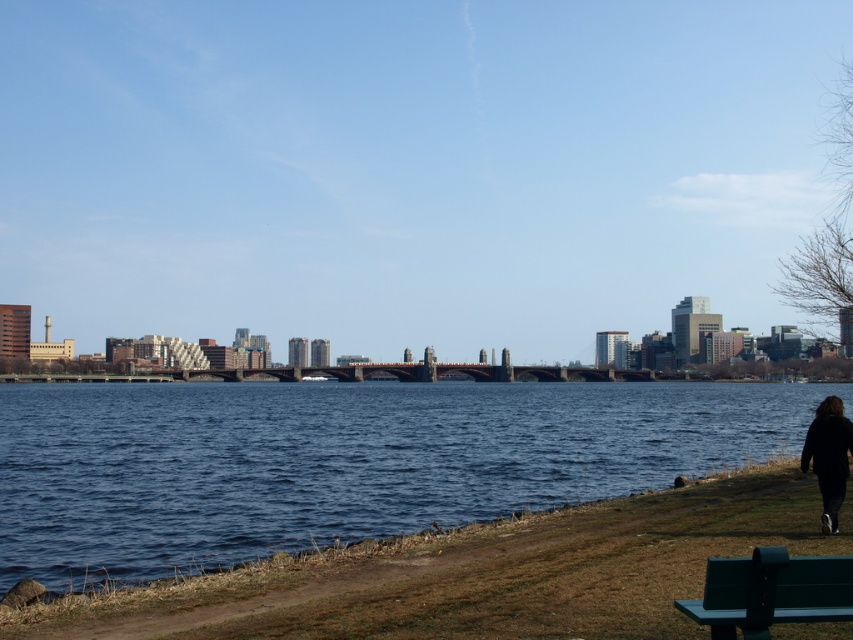
Question: Which point is closer to the camera?

Choices:
 (A) blue water at center
 (B) green painted wood park bench at lower right

Answer: (B)

Question: Is blue water at center further to the viewer compared to black fabric jacket at lower right?

Choices:
 (A) yes
 (B) no

Answer: (B)

Question: Is green painted wood park bench at lower right below black fabric jacket at lower right?

Choices:
 (A) yes
 (B) no

Answer: (B)

Question: Which object is farther from the camera taking this photo?

Choices:
 (A) blue water at center
 (B) green painted wood park bench at lower right

Answer: (A)

Question: Does green painted wood park bench at lower right have a lesser width compared to black fabric jacket at lower right?

Choices:
 (A) yes
 (B) no

Answer: (A)

Question: Among these points, which one is farthest from the camera?

Choices:
 (A) (802, 451)
 (B) (808, 582)
 (C) (36, 536)

Answer: (A)